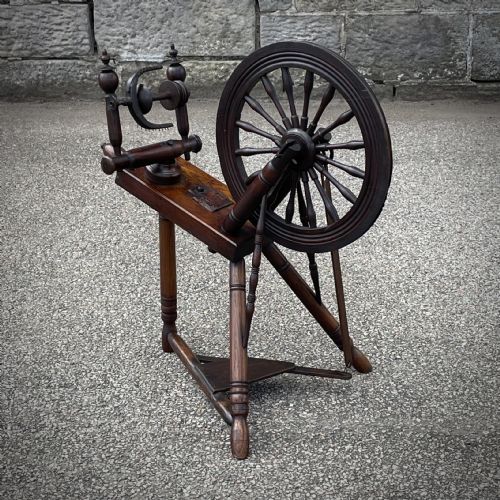
Image resolution: width=500 pixels, height=500 pixels. Find the location of `wooden leg`. wooden leg is located at coordinates (171, 282), (242, 335), (302, 292).